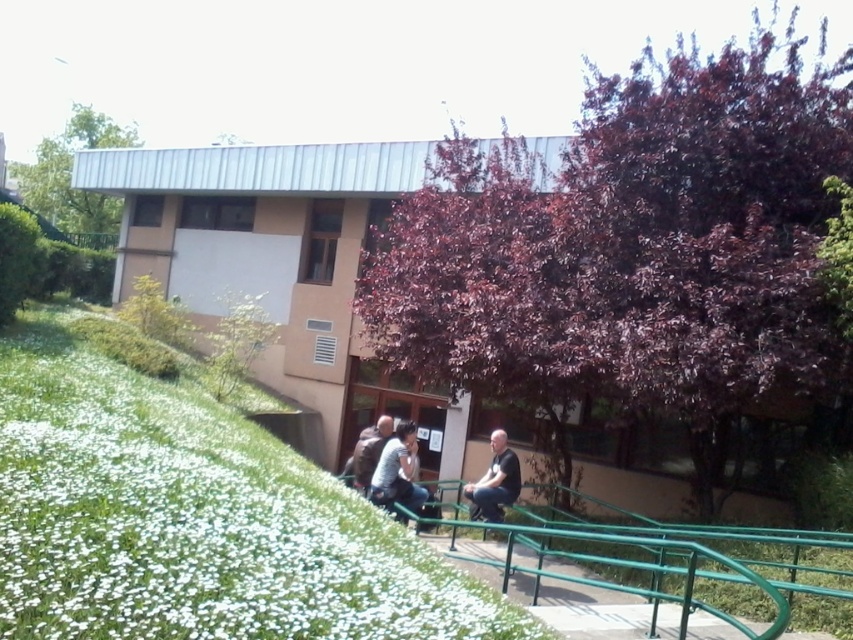
Is white soft grass at lower left bigger than dark gray jeans at center?

Yes.

Who is taller, white soft grass at lower left or dark gray jeans at center?

Standing taller between the two is white soft grass at lower left.

The image size is (853, 640). Find the location of `white soft grass at lower left`. white soft grass at lower left is located at coordinates (194, 520).

This screenshot has width=853, height=640. In order to click on white soft grass at lower left in this screenshot , I will do `click(194, 520)`.

Does purple leafy tree at center have a lesser width compared to brown leather jacket at center?

No.

Does purple leafy tree at center appear under brown leather jacket at center?

Incorrect, purple leafy tree at center is not positioned below brown leather jacket at center.

This screenshot has width=853, height=640. What do you see at coordinates (631, 250) in the screenshot?
I see `purple leafy tree at center` at bounding box center [631, 250].

Where is `purple leafy tree at center`? purple leafy tree at center is located at coordinates (631, 250).

Is green leafy tree at upper left wider than dark gray jeans at center?

Indeed, green leafy tree at upper left has a greater width compared to dark gray jeans at center.

Does point (119, 138) come behind point (511, 472)?

Yes, it is behind point (511, 472).

At what (x,y) coordinates should I click in order to perform the action: click on green leafy tree at upper left. Please return your answer as a coordinate pair (x, y). This screenshot has width=853, height=640. Looking at the image, I should click on (70, 177).